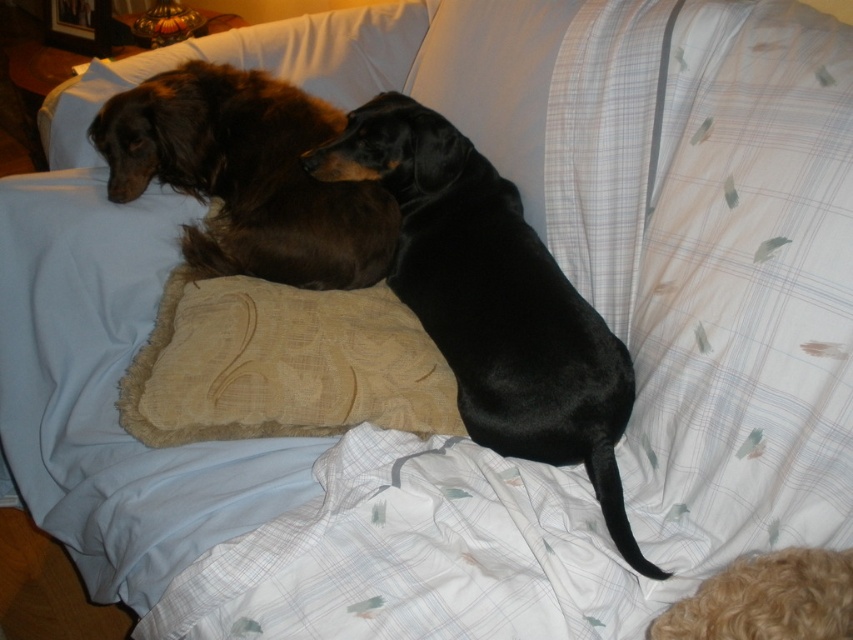
You are standing in front of the couch and want to place a small toy exactly at the point marked by the coordinates point (492, 300). Which dog is closest to this point?

The point (492, 300) corresponds to the black smooth dog at center, so the black smooth dog at center is closest to this point.

You are a photographer trying to capture a closeup of the black smooth dog at center and the shiny brown fur at upper left. Which dog should you focus on first if you want to ensure both are in focus without moving the camera?

The black smooth dog at center is below shiny brown fur at upper left, so you should focus on the shiny brown fur at upper left first since it is closer to the camera.